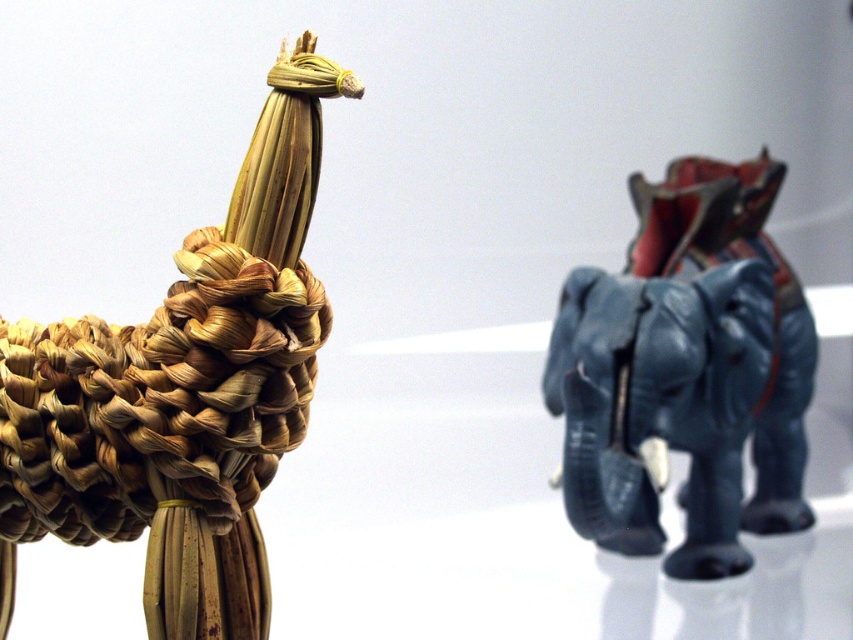
Between braided straw elephant at center and matte blue elephant at right, which one has more height?

braided straw elephant at center is taller.

Does braided straw elephant at center appear over matte blue elephant at right?

Incorrect, braided straw elephant at center is not positioned above matte blue elephant at right.

Does point (317, 280) lie behind point (746, 566)?

No, it is not.

The image size is (853, 640). I want to click on braided straw elephant at center, so click(x=183, y=390).